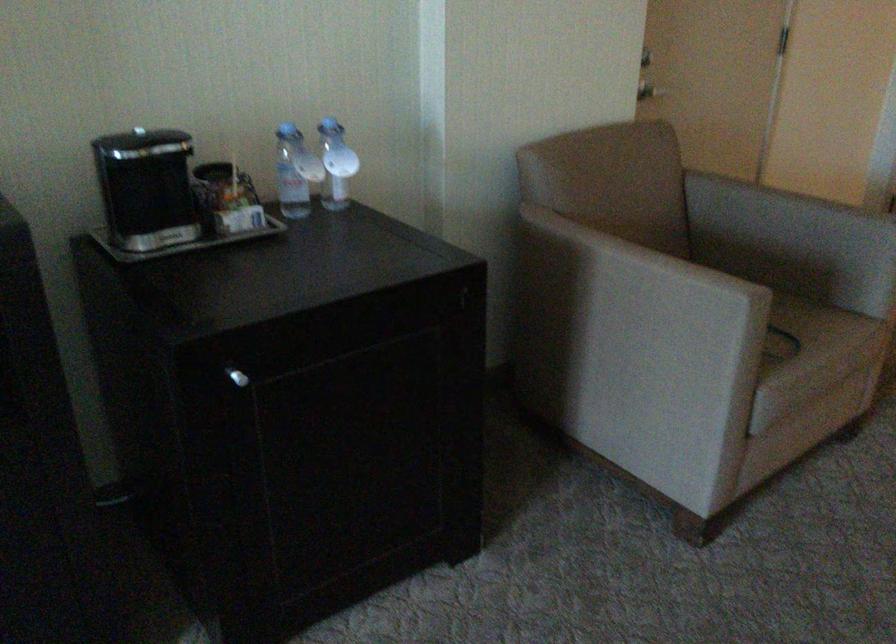
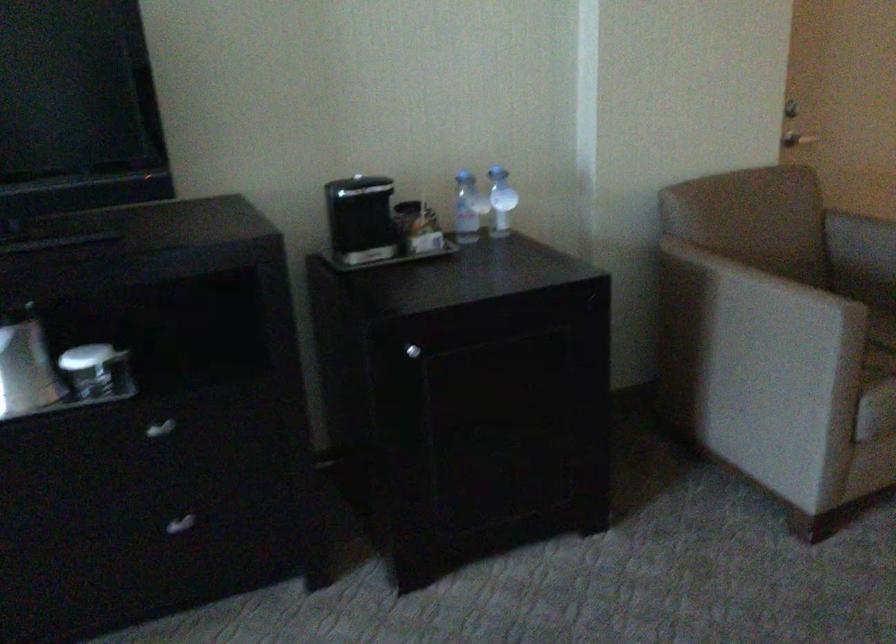
Question: The first image is from the beginning of the video and the second image is from the end. How did the camera likely rotate when shooting the video?

Choices:
 (A) Left
 (B) Right
 (C) Up
 (D) Down

Answer: (A)